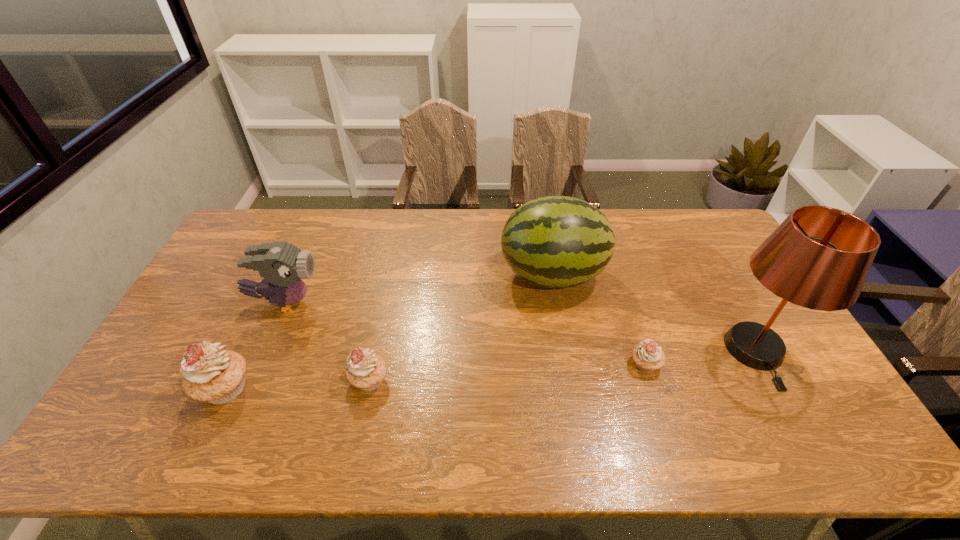
Where is `vacant space located 0.060m on the right of the leftmost cupcake`? The height and width of the screenshot is (540, 960). vacant space located 0.060m on the right of the leftmost cupcake is located at coordinates (276, 388).

Find the location of `vacant space located on the right of the second cupcake from right to left`. vacant space located on the right of the second cupcake from right to left is located at coordinates (446, 380).

Locate an element on the screen. vacant region located on the right of the shortest cupcake is located at coordinates (734, 364).

Identify the location of vacant area situated 0.260m at the beak of the third tallest object. The width and height of the screenshot is (960, 540). (407, 302).

The height and width of the screenshot is (540, 960). I want to click on vacant space located at the stem end of the fifth shortest object, so pyautogui.click(x=396, y=275).

I want to click on free space located at the stem end of the fifth shortest object, so click(420, 275).

I want to click on vacant space located 0.400m at the stem end of the fifth shortest object, so click(x=378, y=275).

Image resolution: width=960 pixels, height=540 pixels. Find the location of `free space located 0.050m on the front-facing side of the lampshade`. free space located 0.050m on the front-facing side of the lampshade is located at coordinates (787, 409).

Find the location of a particular element. Image resolution: width=960 pixels, height=540 pixels. object present at the far edge is located at coordinates (554, 241).

Find the location of `lampshade positioned at the near edge`. lampshade positioned at the near edge is located at coordinates (819, 257).